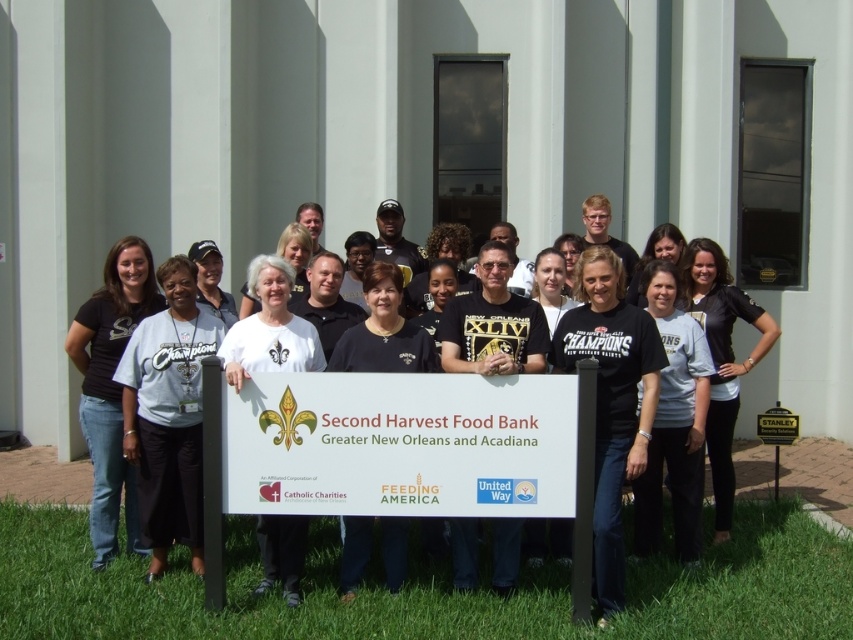
Does point (517, 436) lie in front of point (596, 288)?

Yes, point (517, 436) is closer to viewer.

Who is more distant from viewer, (x=590, y=396) or (x=590, y=256)?

Positioned behind is point (x=590, y=256).

I want to click on white matte sign at center, so click(x=392, y=449).

Can you confirm if gray t-shirt at lower left is thinner than black t-shirt at left?

Yes, gray t-shirt at lower left is thinner than black t-shirt at left.

Who is lower down, gray t-shirt at lower left or black t-shirt at left?

Positioned lower is gray t-shirt at lower left.

Which is in front, point (142, 470) or point (109, 360)?

Point (142, 470) is more forward.

Locate an element on the screen. The height and width of the screenshot is (640, 853). gray t-shirt at lower left is located at coordinates (167, 413).

Is point (656, 346) positioned behind point (97, 506)?

No, it is in front of (97, 506).

Between black matte t-shirt at center and black t-shirt at left, which one is positioned lower?

Positioned lower is black matte t-shirt at center.

Where is `black matte t-shirt at center`? black matte t-shirt at center is located at coordinates (611, 401).